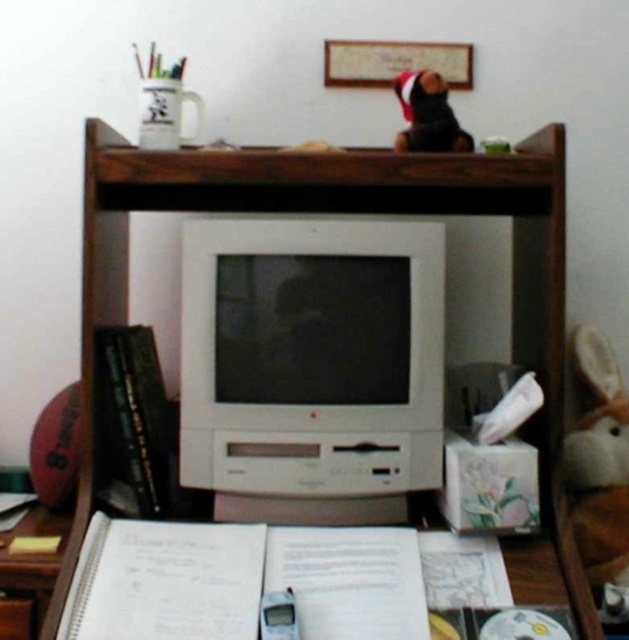
Does white plastic monitor at center have a greater height compared to white plastic computer desk at center?

No, white plastic monitor at center is not taller than white plastic computer desk at center.

Is white plastic monitor at center further to the viewer compared to white plastic computer desk at center?

Yes, white plastic monitor at center is behind white plastic computer desk at center.

Describe the element at coordinates (311, 355) in the screenshot. This screenshot has height=640, width=629. I see `white plastic monitor at center` at that location.

The image size is (629, 640). In order to click on white plastic monitor at center in this screenshot , I will do `click(311, 355)`.

Is white plastic computer desk at center bigger than wooden drawer at lower left?

Correct, white plastic computer desk at center is larger in size than wooden drawer at lower left.

The image size is (629, 640). What do you see at coordinates (352, 211) in the screenshot?
I see `white plastic computer desk at center` at bounding box center [352, 211].

Is point (509, 161) positioned in front of point (8, 625)?

No, it is behind (8, 625).

This screenshot has height=640, width=629. In order to click on white plastic computer desk at center in this screenshot , I will do `click(352, 211)`.

Can you confirm if white plastic monitor at center is taller than wooden drawer at lower left?

Correct, white plastic monitor at center is much taller as wooden drawer at lower left.

Does white plastic monitor at center have a greater width compared to wooden drawer at lower left?

Yes, white plastic monitor at center is wider than wooden drawer at lower left.

Identify the location of white plastic monitor at center. (311, 355).